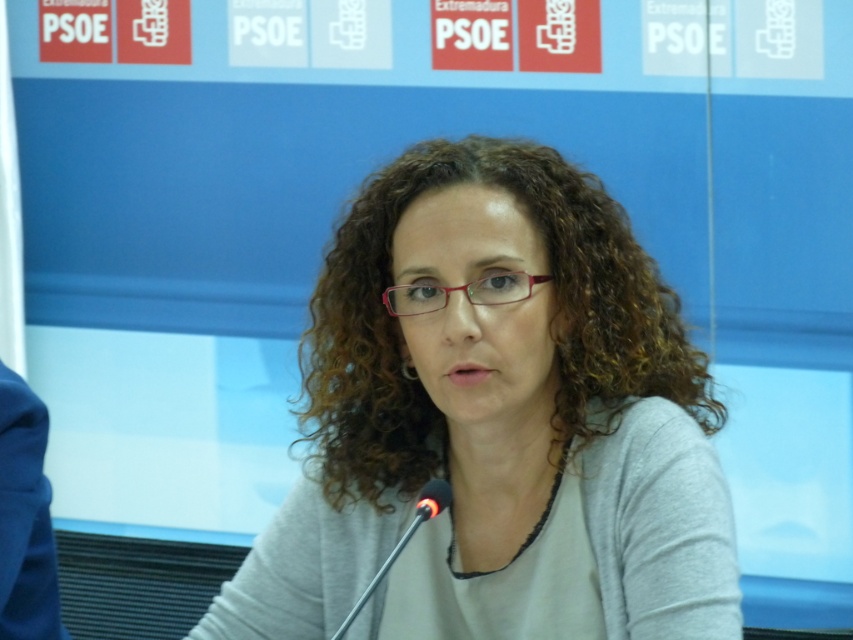
Is gray matte sweater at center thinner than black plastic microphone at center?

Incorrect, gray matte sweater at center's width is not less than black plastic microphone at center's.

Is point (595, 604) closer to viewer compared to point (384, 561)?

Yes, it is in front of point (384, 561).

This screenshot has width=853, height=640. What do you see at coordinates (496, 420) in the screenshot?
I see `gray matte sweater at center` at bounding box center [496, 420].

I want to click on gray matte sweater at center, so click(496, 420).